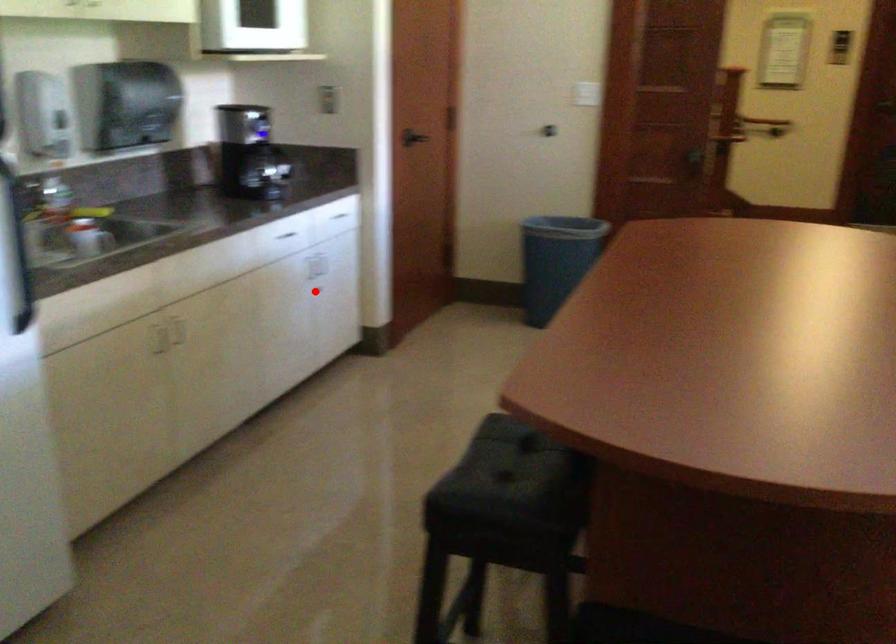
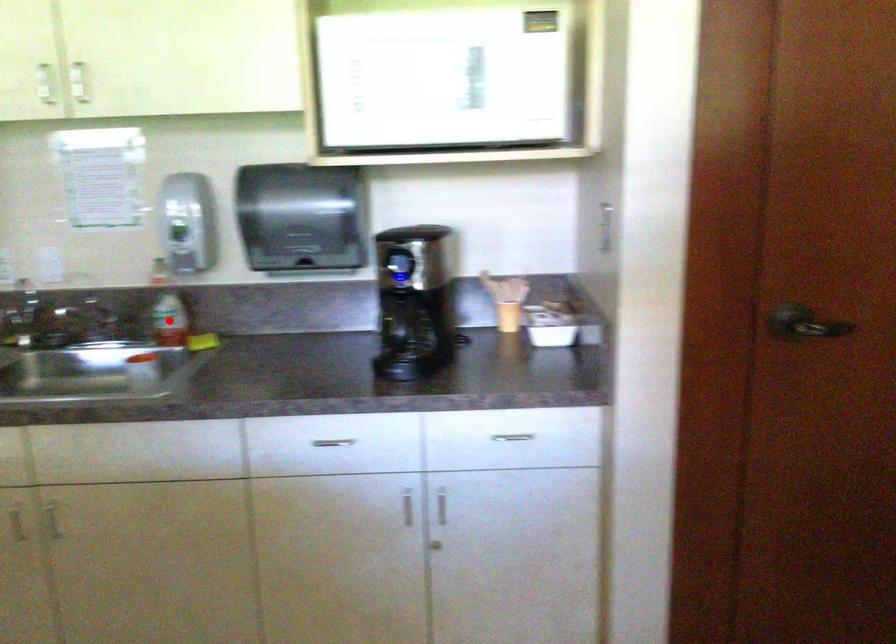
I am providing you with two images of the same scene from different viewpoints. A red point is marked on the first image and another point is marked on the second image. Is the marked point in image1 the same physical position as the marked point in image2?

No